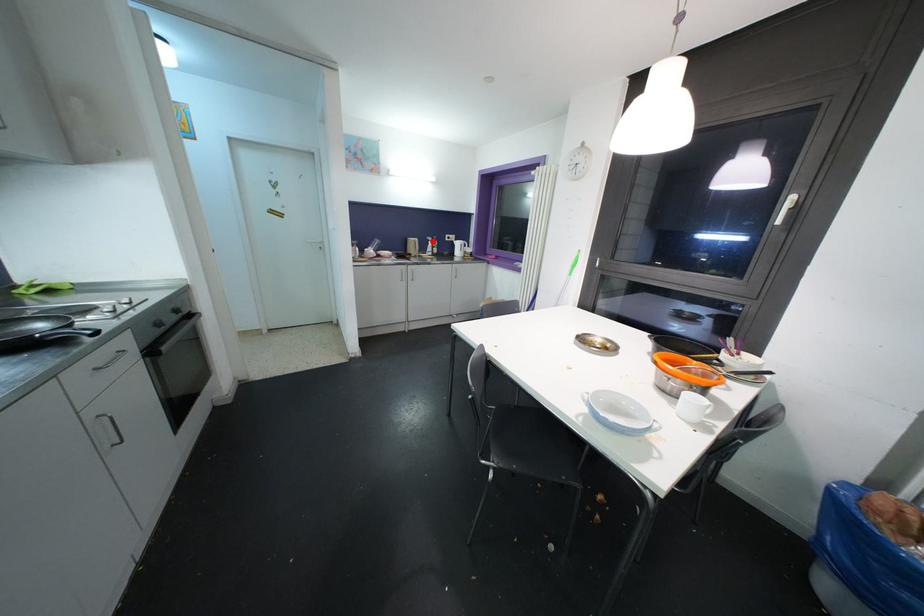
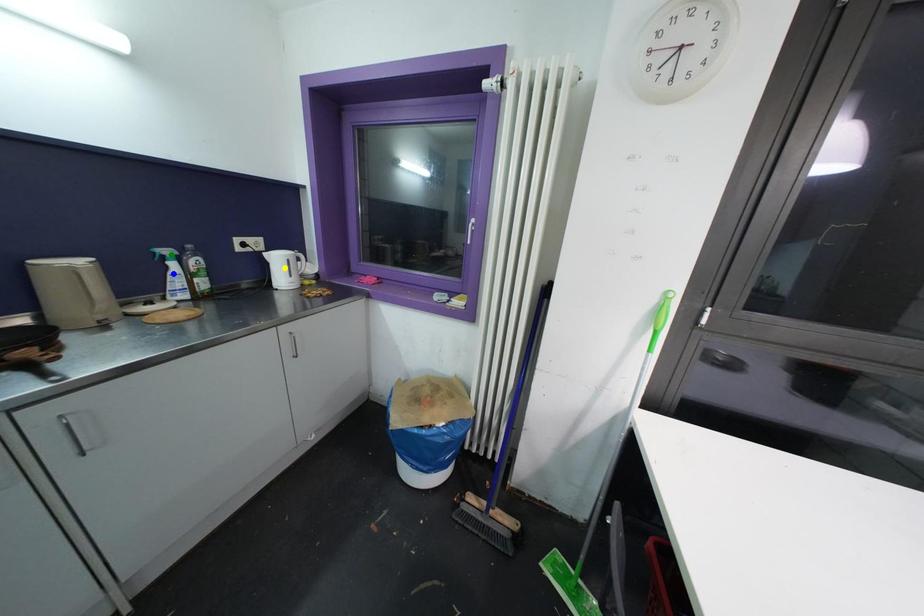
Question: I am providing you with two images of the same scene from different viewpoints. A red point is marked on the first image. You are given multiple points on the second image. Can you choose the point in image 2 that corresponds to the point in image 1?

Choices:
 (A) yellow point
 (B) green point
 (C) blue point

Answer: (B)